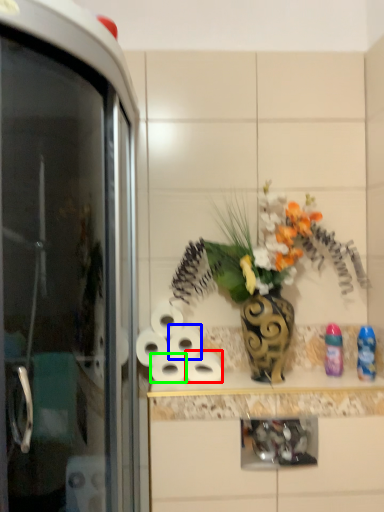
Question: Which is farther away from toilet paper (highlighted by a red box)? toilet paper (highlighted by a blue box) or toilet paper (highlighted by a green box)?

Choices:
 (A) toilet paper
 (B) toilet paper

Answer: (B)